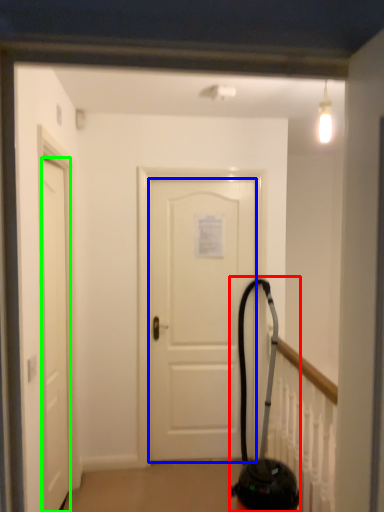
Question: Which object is the farthest from extinguisher (highlighted by a red box)? Choose among these: door (highlighted by a blue box) or door (highlighted by a green box).

Choices:
 (A) door
 (B) door

Answer: (B)